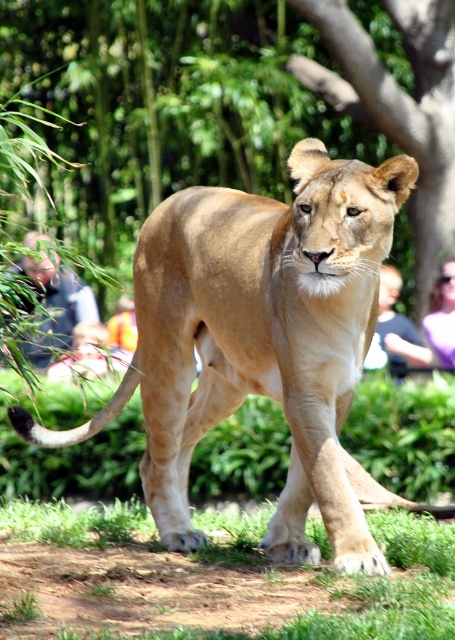
You are a zookeeper planning to place a new feeding station for the lioness. The feeding station requires a clear path from the lioness to the tree at center. Given the lioness is currently at the edge of the enclosure, can you confirm if the path from the lioness to the brown textured tree at center is unobstructed?

The brown textured tree at center is located at point (398, 106), so the path from the lioness at the edge of the enclosure to the tree is unobstructed as there are no objects mentioned in the scene blocking the path.

You are a zookeeper who needs to place a 2.4 meter long fence panel between the green leafy tree at center and the smooth skin person at right. Will the panel fit perfectly between them?

The distance between the green leafy tree at center and the smooth skin person at right is 2.55 meters, so a 2.4 meter long fence panel will fit with 0.15 meters of space remaining.